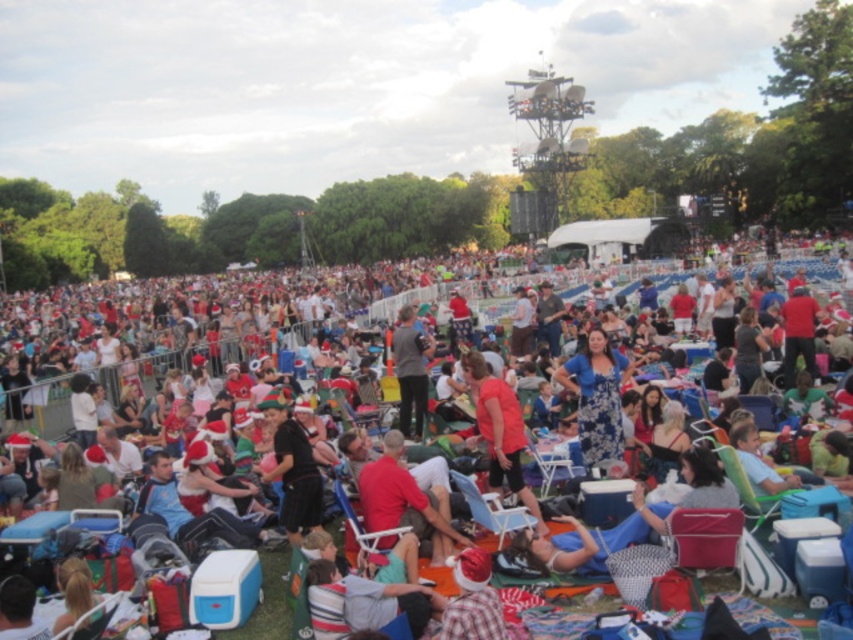
Can you confirm if matte red santa hat at center is taller than dark gray fabric jacket at center?

Yes, matte red santa hat at center is taller than dark gray fabric jacket at center.

Is matte red santa hat at center shorter than dark gray fabric jacket at center?

No.

Who is more forward, [44,314] or [403,317]?

Point [403,317] is more forward.

The width and height of the screenshot is (853, 640). I want to click on matte red santa hat at center, so click(183, 349).

Does red shirt at center have a lesser height compared to blue plastic chair at center?

Incorrect, red shirt at center's height does not fall short of blue plastic chair at center's.

Find the location of a particular element. This screenshot has width=853, height=640. red shirt at center is located at coordinates (405, 500).

At what (x,y) coordinates should I click in order to perform the action: click on red shirt at center. Please return your answer as a coordinate pair (x, y). This screenshot has width=853, height=640. Looking at the image, I should click on (405, 500).

Is point (120, 301) positioned after point (413, 493)?

Yes.

Who is positioned more to the left, matte red santa hat at center or red shirt at center?

From the viewer's perspective, matte red santa hat at center appears more on the left side.

Image resolution: width=853 pixels, height=640 pixels. What are the coordinates of `matte red santa hat at center` in the screenshot? It's located at (183, 349).